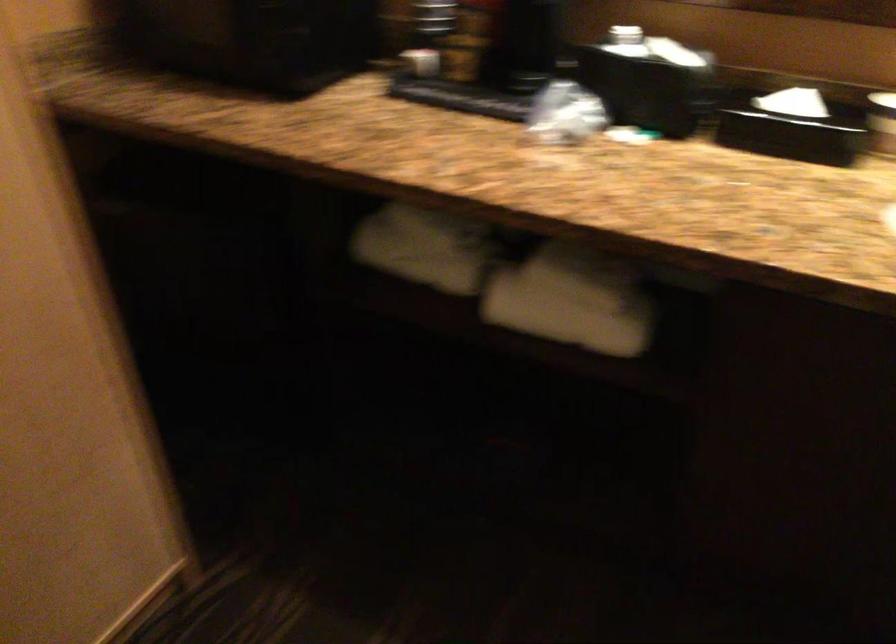
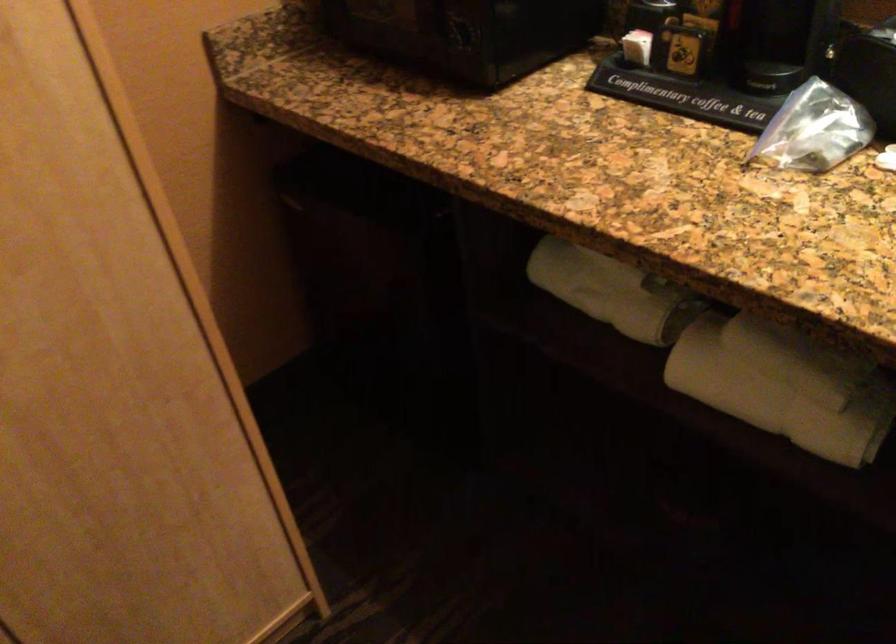
In the second image, find the point that corresponds to [565,319] in the first image.

(770, 402)